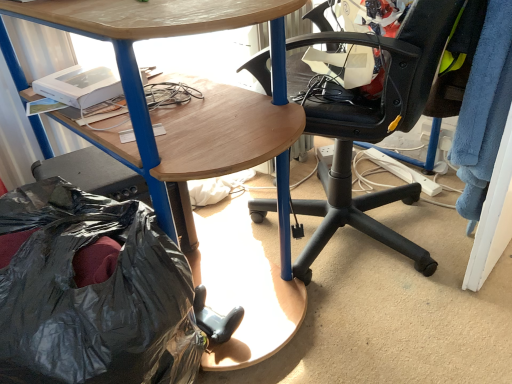
Question: In terms of size, does wooden desk at center appear bigger or smaller than black plastic bag at lower left?

Choices:
 (A) small
 (B) big

Answer: (B)

Question: Considering the positions of wooden desk at center and black plastic bag at lower left in the image, is wooden desk at center taller or shorter than black plastic bag at lower left?

Choices:
 (A) tall
 (B) short

Answer: (A)

Question: Based on their relative distances, which object is nearer to the black plastic chair at center?

Choices:
 (A) black plastic bag at lower left
 (B) wooden desk at center

Answer: (B)

Question: Considering the real-world distances, which object is farthest from the black plastic chair at center?

Choices:
 (A) wooden desk at center
 (B) black plastic bag at lower left

Answer: (B)